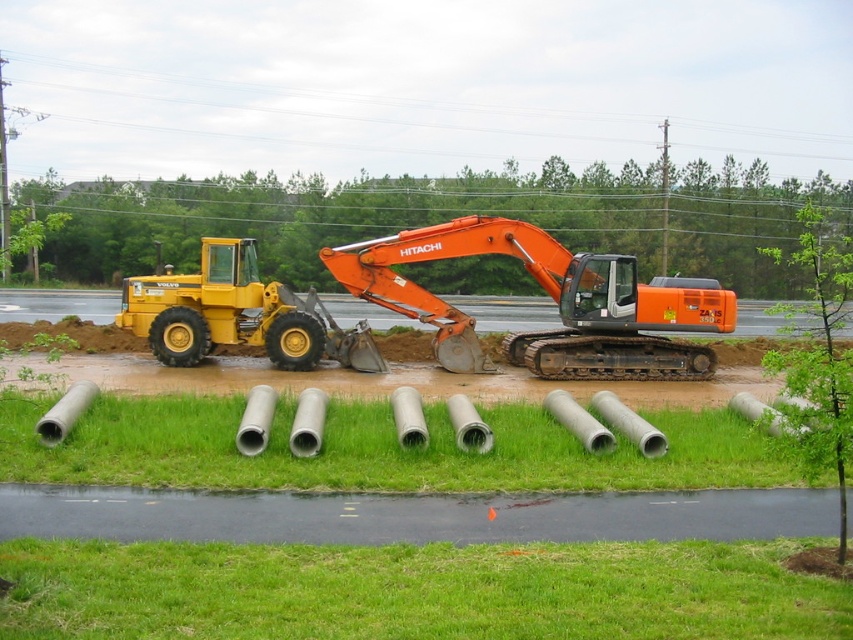
Question: Does green concrete pipes at lower center have a smaller size compared to orange metallic excavator at center?

Choices:
 (A) no
 (B) yes

Answer: (B)

Question: Is green grass at lower center in front of yellow rubber tractor at left?

Choices:
 (A) no
 (B) yes

Answer: (B)

Question: Which point is closer to the camera?

Choices:
 (A) (468, 355)
 (B) (314, 358)
 (C) (231, 433)
 (D) (350, 582)

Answer: (D)

Question: Estimate the real-world distances between objects in this image. Which object is closer to the yellow rubber tractor at left?

Choices:
 (A) green grass at lower center
 (B) green concrete pipes at lower center
 (C) orange metallic excavator at center

Answer: (C)

Question: Which object appears closest to the camera in this image?

Choices:
 (A) green grass at lower center
 (B) green concrete pipes at lower center
 (C) yellow rubber tractor at left

Answer: (A)

Question: Is orange metallic excavator at center further to camera compared to yellow rubber tractor at left?

Choices:
 (A) yes
 (B) no

Answer: (A)